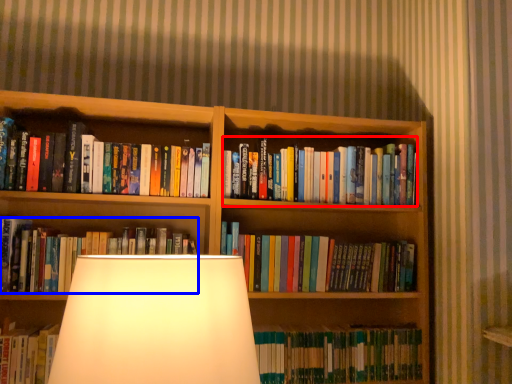
Question: Which of the following is the closest to the observer, book (highlighted by a red box) or book (highlighted by a blue box)?

Choices:
 (A) book
 (B) book

Answer: (B)